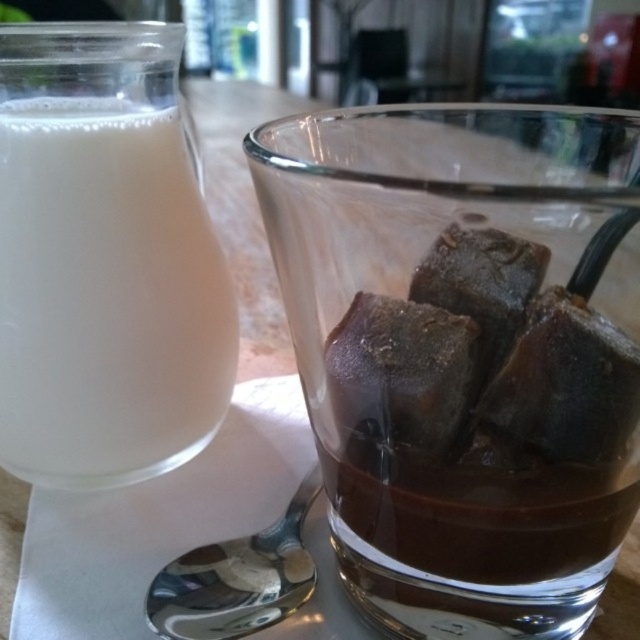
Question: Can you confirm if dark chocolate cube at center is positioned to the left of satin silver spoon at lower center?

Choices:
 (A) no
 (B) yes

Answer: (A)

Question: Which object is closer to the camera taking this photo?

Choices:
 (A) satin silver spoon at lower center
 (B) white opaque liquid at left
 (C) dark chocolate cube at center

Answer: (C)

Question: Does dark chocolate cube at center lie behind satin silver spoon at lower center?

Choices:
 (A) no
 (B) yes

Answer: (A)

Question: Among these objects, which one is farthest from the camera?

Choices:
 (A) white opaque liquid at left
 (B) satin silver spoon at lower center

Answer: (A)

Question: Is white opaque liquid at left positioned behind satin silver spoon at lower center?

Choices:
 (A) yes
 (B) no

Answer: (A)

Question: Which point appears closest to the camera in this image?

Choices:
 (A) pos(362,381)
 (B) pos(138,368)
 (C) pos(204,547)

Answer: (A)